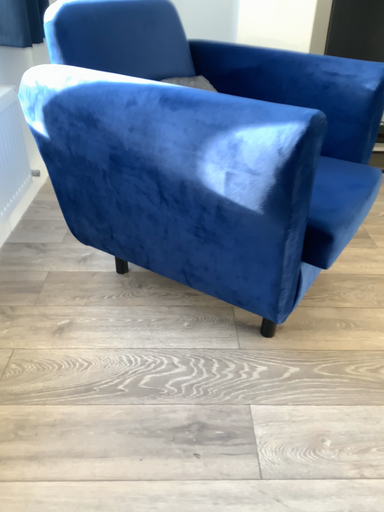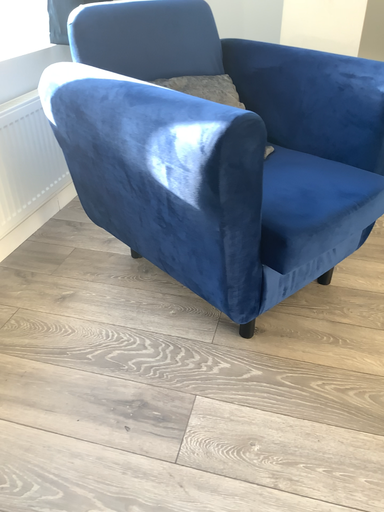
Question: How did the camera likely rotate when shooting the video?

Choices:
 (A) rotated right
 (B) rotated left

Answer: (B)